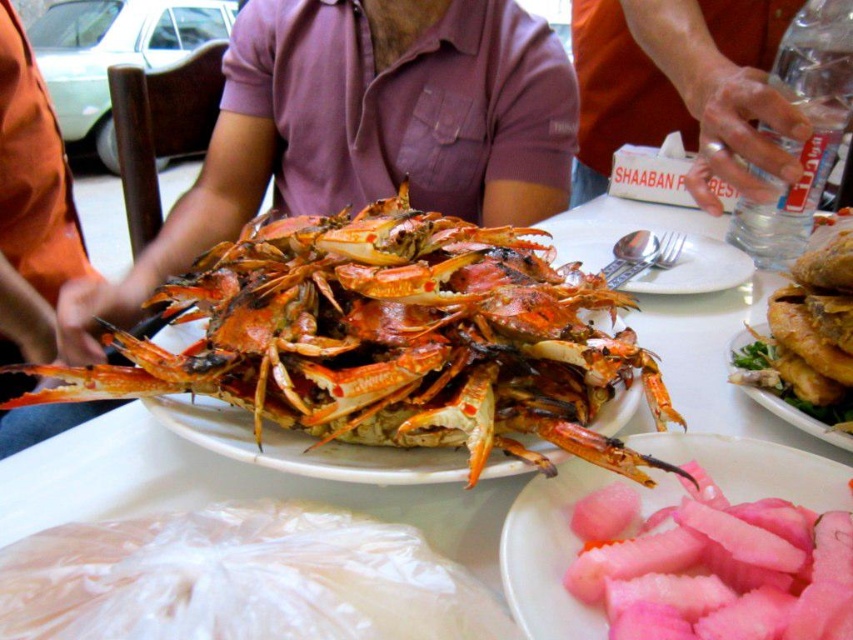
Does pink translucent pickled ginger at center have a larger size compared to golden crispy fried chicken at center?

Yes, pink translucent pickled ginger at center is bigger than golden crispy fried chicken at center.

Which is in front, point (628, 481) or point (840, 436)?

Point (628, 481) is more forward.

Find the location of a particular element. The image size is (853, 640). pink translucent pickled ginger at center is located at coordinates (560, 548).

Which is more to the left, grilled orange lobster at center or pink translucent pickled ginger at center?

grilled orange lobster at center

Does grilled orange lobster at center have a greater height compared to pink translucent pickled ginger at center?

Yes.

The width and height of the screenshot is (853, 640). What are the coordinates of `grilled orange lobster at center` in the screenshot? It's located at (392, 339).

Is grilled orange lobster at center positioned at the back of orange fabric hand at upper right?

No, grilled orange lobster at center is closer to the viewer.

Is grilled orange lobster at center wider than orange fabric hand at upper right?

Correct, the width of grilled orange lobster at center exceeds that of orange fabric hand at upper right.

The image size is (853, 640). What are the coordinates of `grilled orange lobster at center` in the screenshot? It's located at (392, 339).